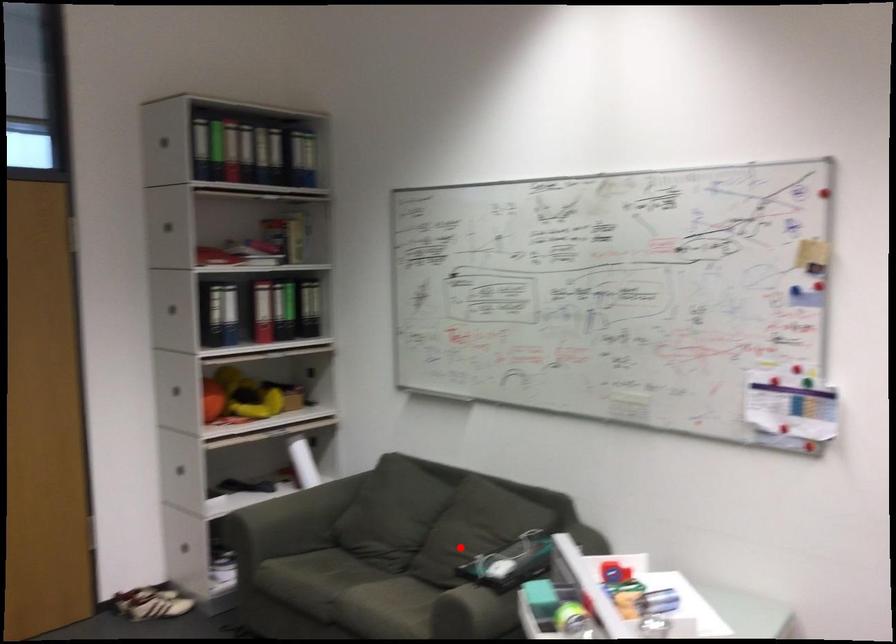
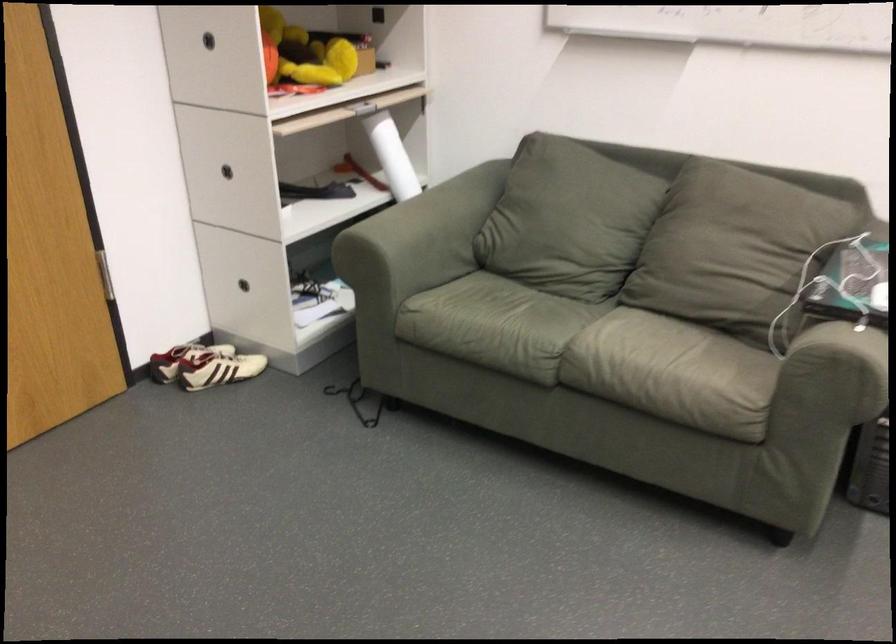
The point at the highlighted location is marked in the first image. Where is the corresponding point in the second image?

(728, 243)